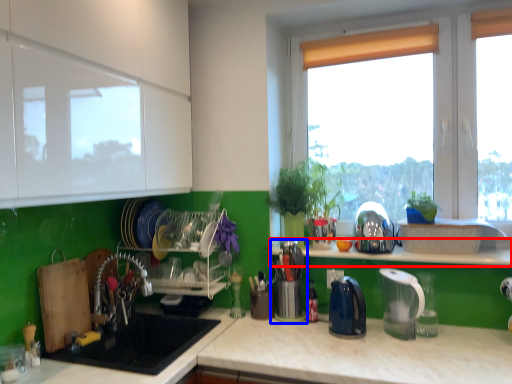
Question: Which point is closer to the camera, window sill (highlighted by a red box) or appliance (highlighted by a blue box)?

Choices:
 (A) window sill
 (B) appliance

Answer: (A)